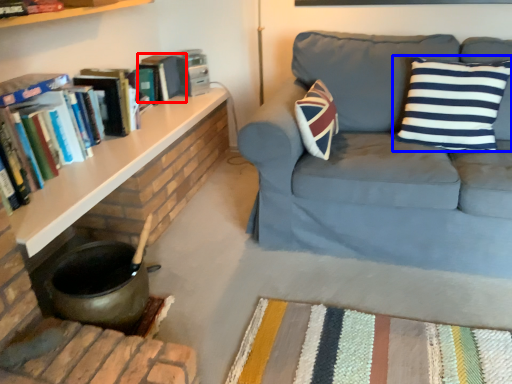
Question: Which object is closer to the camera taking this photo, paperback book (highlighted by a red box) or pillow (highlighted by a blue box)?

Choices:
 (A) paperback book
 (B) pillow

Answer: (B)